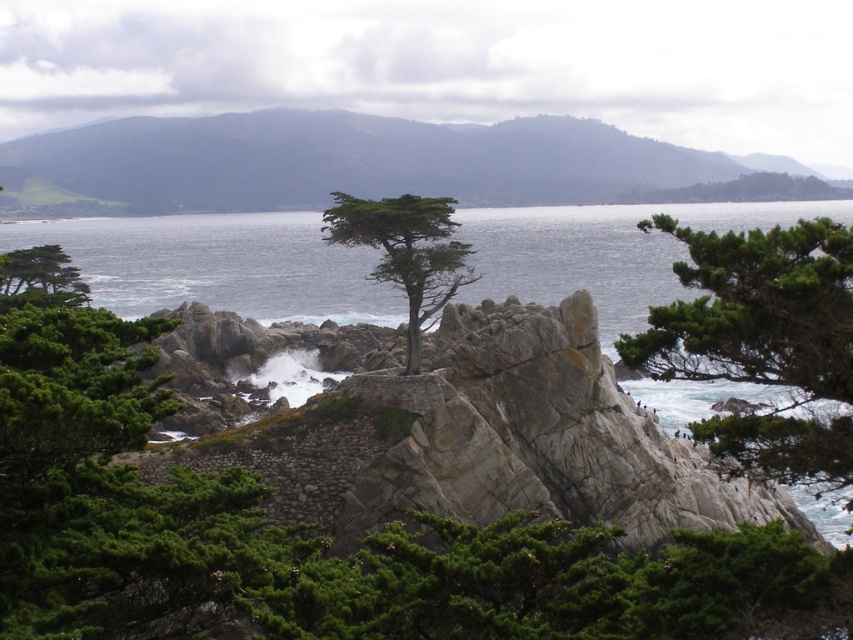
You are standing on the rocky outcrop and want to determine the relative heights of the gray water at center and the green textured tree at center. Based on the scene, which one is taller?

The gray water at center is much taller than the green textured tree at center, so the gray water at center is taller.

You are a hiker standing at the edge of the coastal cliff. You see the gray water at center and the green matte tree at left. Which object is nearer to you?

The gray water at center is closer to the viewer than the green matte tree at left.

You are standing at the base of the rocky outcrop where the lone cypress tree grows. Looking out towards the ocean, you notice a specific point marked at coordinates (x=219, y=266). What is the color and location of the object at this point?

The point at coordinates (x=219, y=266) corresponds to gray water at center.